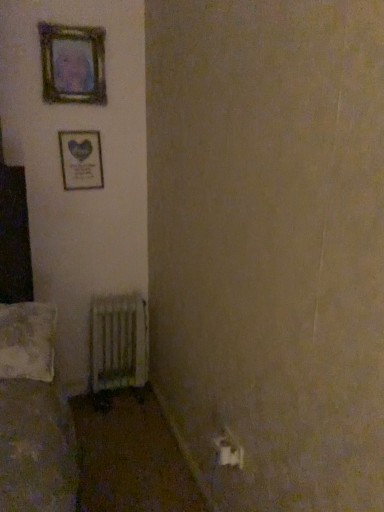
Question: Is wooden frame at upper left, placed as the second picture frame when sorted from top to bottom, smaller than wooden frame at upper left, the first picture frame from the top?

Choices:
 (A) yes
 (B) no

Answer: (A)

Question: Considering the relative positions of wooden frame at upper left, placed as the second picture frame when sorted from top to bottom, and wooden frame at upper left, the first picture frame from the top, in the image provided, is wooden frame at upper left, placed as the second picture frame when sorted from top to bottom, to the right of wooden frame at upper left, the first picture frame from the top, from the viewer's perspective?

Choices:
 (A) no
 (B) yes

Answer: (B)

Question: From a real-world perspective, is wooden frame at upper left, placed as the second picture frame when sorted from top to bottom, positioned over wooden frame at upper left, the first picture frame from the top, based on gravity?

Choices:
 (A) yes
 (B) no

Answer: (B)

Question: Can we say wooden frame at upper left, which ranks as the 1th picture frame in bottom-to-top order, lies outside wooden frame at upper left, the 2th picture frame in the bottom-to-top sequence?

Choices:
 (A) no
 (B) yes

Answer: (B)

Question: Can you confirm if wooden frame at upper left, placed as the second picture frame when sorted from top to bottom, is taller than wooden frame at upper left, the first picture frame from the top?

Choices:
 (A) no
 (B) yes

Answer: (A)

Question: Does wooden frame at upper left, which ranks as the 1th picture frame in bottom-to-top order, touch wooden frame at upper left, the first picture frame from the top?

Choices:
 (A) no
 (B) yes

Answer: (A)

Question: Is white plastic electric outlet at lower right positioned with its back to metallic radiator at lower left?

Choices:
 (A) yes
 (B) no

Answer: (B)

Question: Is white plastic electric outlet at lower right not inside metallic radiator at lower left?

Choices:
 (A) no
 (B) yes

Answer: (B)

Question: Can you confirm if white plastic electric outlet at lower right is smaller than metallic radiator at lower left?

Choices:
 (A) yes
 (B) no

Answer: (A)

Question: From the image's perspective, would you say white plastic electric outlet at lower right is positioned over metallic radiator at lower left?

Choices:
 (A) no
 (B) yes

Answer: (A)

Question: Does white plastic electric outlet at lower right appear on the right side of metallic radiator at lower left?

Choices:
 (A) yes
 (B) no

Answer: (A)

Question: Is white plastic electric outlet at lower right thinner than metallic radiator at lower left?

Choices:
 (A) no
 (B) yes

Answer: (B)

Question: Is white textured pillow at lower left wider than wooden frame at upper left, the first picture frame from the top?

Choices:
 (A) no
 (B) yes

Answer: (B)